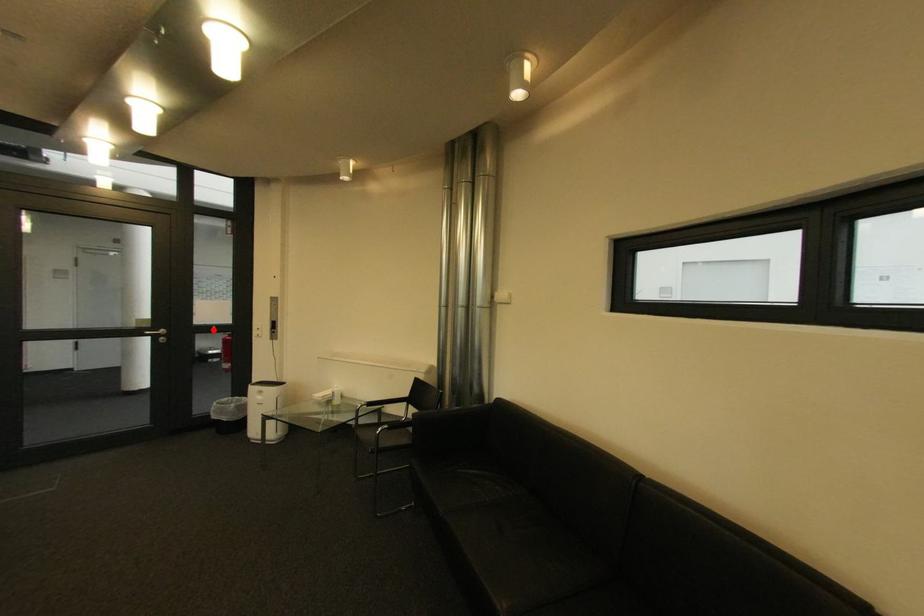
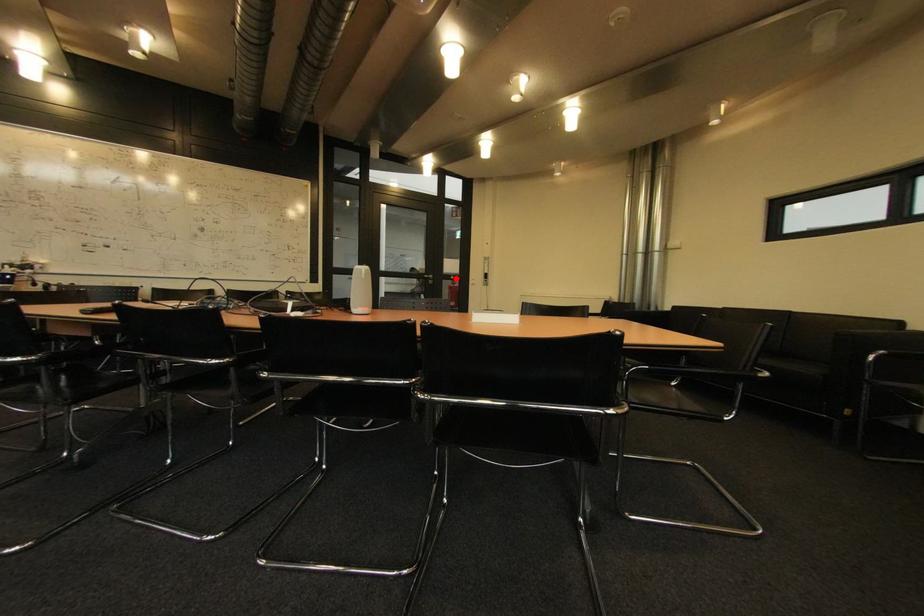
I am providing you with two images of the same scene from different viewpoints. A red point is marked on the first image and another point is marked on the second image. Does the point marked in image1 correspond to the same location as the one in image2?

Yes